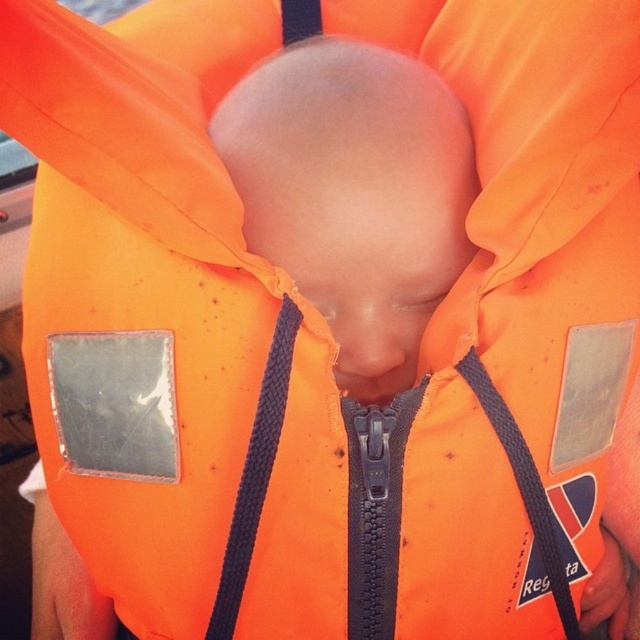
You are a safety inspector checking the straps of the life jacket. You notice two straps at the center of the jacket. The black braided strap at center and the black fabric strap at center. Which strap is closer to the other one?

The black braided strap at center is 7.77 inches from the black fabric strap at center, so they are both equally close to each other since the distance between them is the same.

You are a photographer taking a close up of a baby in a life jacket. You need to focus on two points on the life jacket. The first point is at coordinate point (451, 186) and the second point is at coordinate point (493, 390). Which point is closer to you?

Point (451, 186) is closer to you than point (493, 390) because it is further to the viewer according to the description.